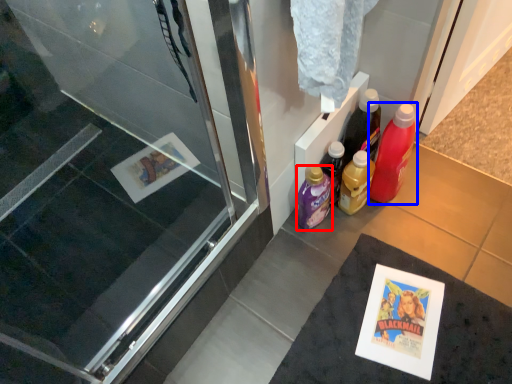
Question: Which point is further to the camera, bottle (highlighted by a red box) or bottle (highlighted by a blue box)?

Choices:
 (A) bottle
 (B) bottle

Answer: (A)